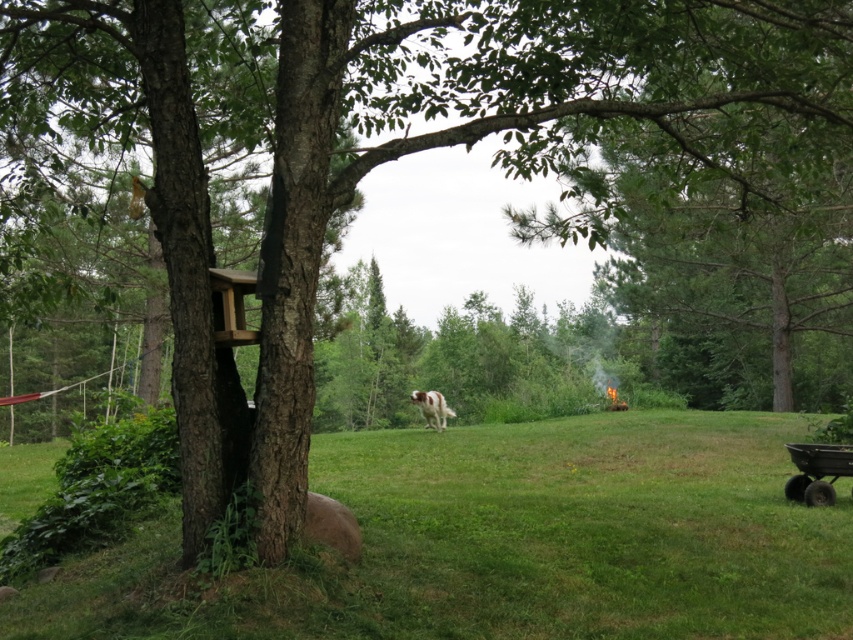
Question: Which of the following is the farthest from the observer?

Choices:
 (A) (776, 556)
 (B) (428, 408)

Answer: (B)

Question: Considering the relative positions of green grass at center and white fur with brown spots at center in the image provided, where is green grass at center located with respect to white fur with brown spots at center?

Choices:
 (A) below
 (B) above

Answer: (A)

Question: Which of the following is the farthest from the observer?

Choices:
 (A) green grass at center
 (B) white fur with brown spots at center

Answer: (B)

Question: Does green grass at center have a greater width compared to white fur with brown spots at center?

Choices:
 (A) no
 (B) yes

Answer: (B)

Question: Which point appears closest to the camera in this image?

Choices:
 (A) (561, 426)
 (B) (428, 392)

Answer: (A)

Question: Where is green grass at center located in relation to white fur with brown spots at center in the image?

Choices:
 (A) left
 (B) right

Answer: (A)